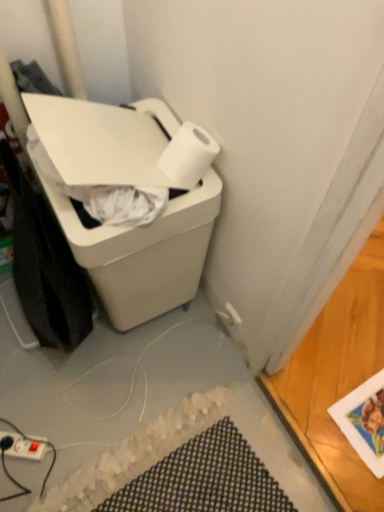
Question: Considering the relative positions of white plastic trash can at lower left and matte white power plugs and sockets at lower left in the image provided, is white plastic trash can at lower left to the left or to the right of matte white power plugs and sockets at lower left?

Choices:
 (A) right
 (B) left

Answer: (A)

Question: Is white plastic trash can at lower left inside the boundaries of matte white power plugs and sockets at lower left, or outside?

Choices:
 (A) inside
 (B) outside

Answer: (B)

Question: Which object is positioned closest to the black textured bath mat at lower center?

Choices:
 (A) white matte paper towel at upper right
 (B) matte white power plugs and sockets at lower left
 (C) white plastic trash can at lower left

Answer: (B)

Question: Considering the real-world distances, which object is closest to the matte white power plugs and sockets at lower left?

Choices:
 (A) white matte paper towel at upper right
 (B) white plastic trash can at lower left
 (C) black textured bath mat at lower center

Answer: (C)